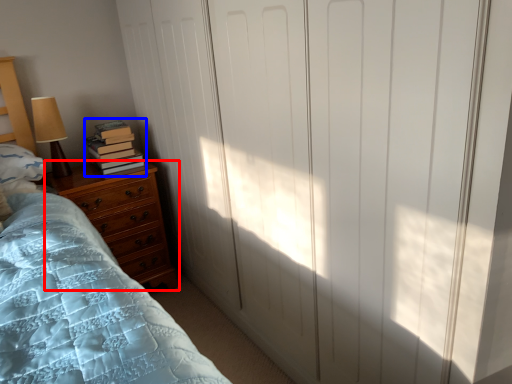
Question: Among these objects, which one is farthest to the camera, chest of drawers (highlighted by a red box) or book (highlighted by a blue box)?

Choices:
 (A) chest of drawers
 (B) book

Answer: (B)